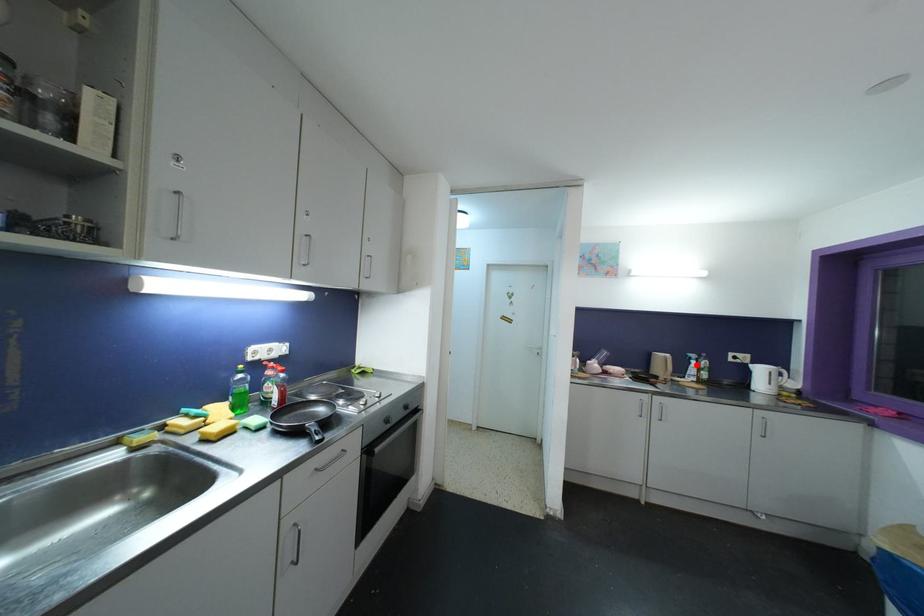
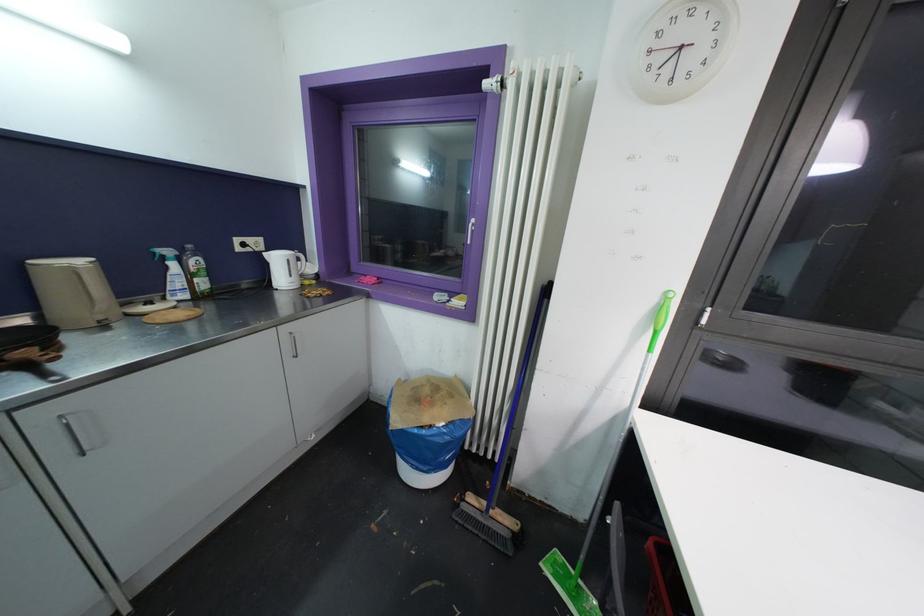
Find the pixel in the second image that matches the highlighted location in the first image.

(176, 267)